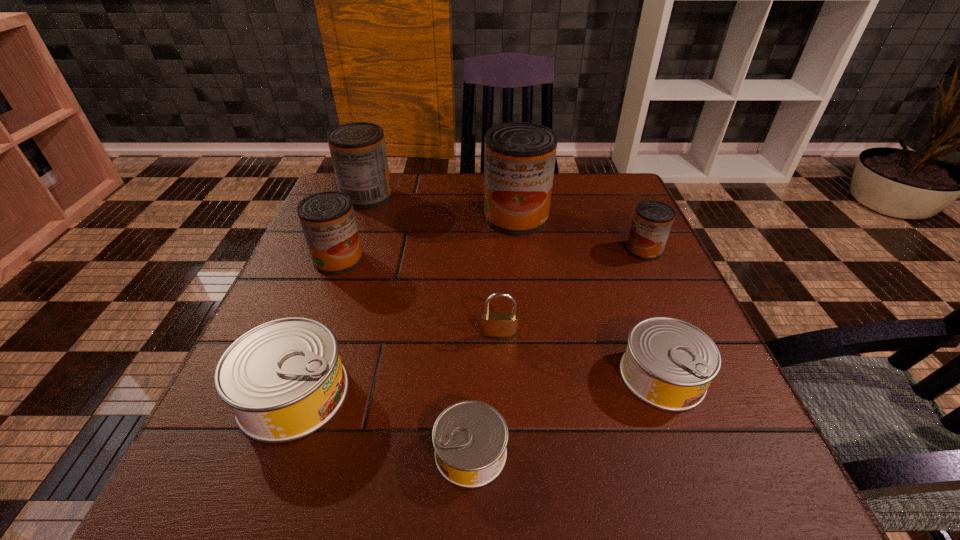
Where is `blank space located 0.130m on the back of the second smallest silver can`? blank space located 0.130m on the back of the second smallest silver can is located at coordinates (632, 295).

Where is `vacant space located on the right of the shortest can`? vacant space located on the right of the shortest can is located at coordinates (581, 452).

Identify the location of object that is at the near edge. (470, 438).

Find the location of a particular element. The width and height of the screenshot is (960, 540). object positioned at the far left corner is located at coordinates (358, 151).

Where is `vacant area at the far edge`? The height and width of the screenshot is (540, 960). vacant area at the far edge is located at coordinates (405, 185).

Image resolution: width=960 pixels, height=540 pixels. In the image, there is a desktop. In order to click on free space at the near edge in this screenshot , I will do `click(536, 477)`.

The width and height of the screenshot is (960, 540). I want to click on vacant space at the left edge of the desktop, so click(308, 304).

The width and height of the screenshot is (960, 540). In order to click on blank space at the right edge of the desktop in this screenshot , I will do click(649, 306).

This screenshot has height=540, width=960. What are the coordinates of `free space at the far right corner` in the screenshot? It's located at (612, 181).

You are a GUI agent. You are given a task and a screenshot of the screen. Output one action in this format:
    pyautogui.click(x=<x>, y=<y>)
    Task: Click on the vacant point located between the second shortest can and the padlock
    This screenshot has height=540, width=960.
    Given the screenshot: What is the action you would take?
    coord(581,356)